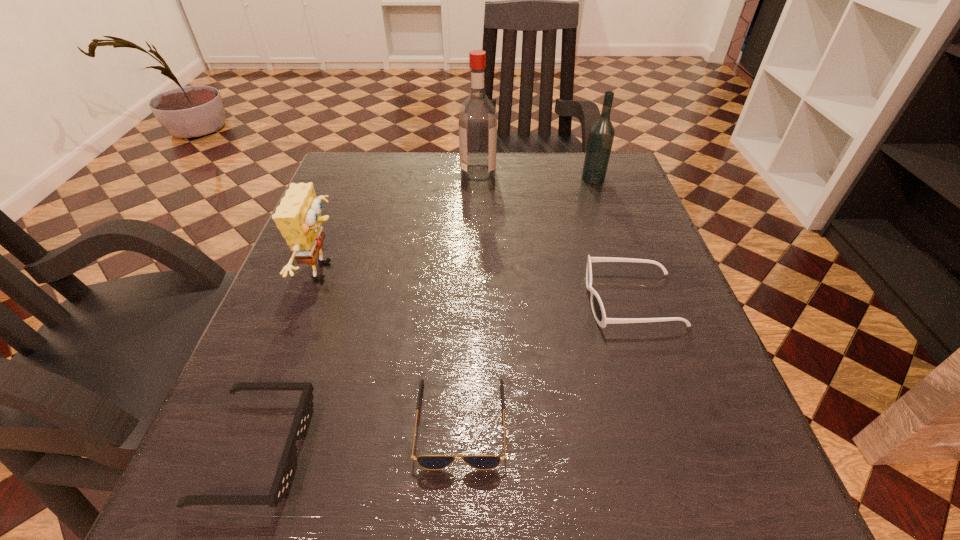
Identify which sunglasses is the second nearest to the rightmost sunglasses. Please provide its 2D coordinates. Your answer should be formatted as a tuple, i.e. [(x, y)], where the tuple contains the x and y coordinates of a point satisfying the conditions above.

[(285, 473)]

In order to click on free space that satisfies the following two spatial constraints: 1. on the front-facing side of the second sunglasses from left to right; 2. on the front-facing side of the leftmost sunglasses in this screenshot , I will do `click(460, 450)`.

Where is `vacant space that satisfies the following two spatial constraints: 1. on the front-facing side of the liquor; 2. on the front-facing side of the second sunglasses from right to left`? vacant space that satisfies the following two spatial constraints: 1. on the front-facing side of the liquor; 2. on the front-facing side of the second sunglasses from right to left is located at coordinates (476, 422).

Locate an element on the screen. This screenshot has height=540, width=960. vacant space that satisfies the following two spatial constraints: 1. on the front-facing side of the tallest object; 2. on the front-facing side of the second sunglasses from left to right is located at coordinates (476, 422).

Find the location of a particular element. vacant area that satisfies the following two spatial constraints: 1. on the back side of the second tallest object; 2. on the front-facing side of the liquor is located at coordinates (591, 173).